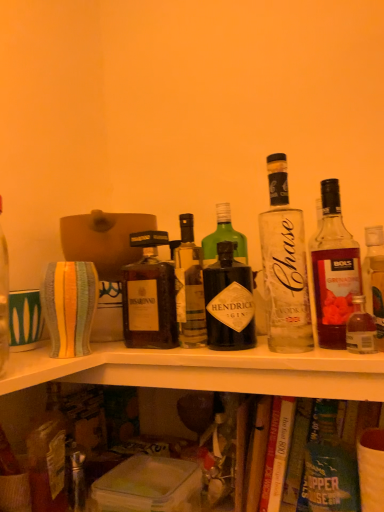
Question: Is dark brown glass bottle at center, which is the 2th bottle in left-to-right order, to the left or to the right of green glass bottle at center, acting as the third bottle starting from the right, in the image?

Choices:
 (A) right
 (B) left

Answer: (B)

Question: Does point (188, 314) appear closer or farther from the camera than point (311, 468)?

Choices:
 (A) farther
 (B) closer

Answer: (A)

Question: Estimate the real-world distances between objects in this image. Which object is farther from the green glass bottle at center, the fourth bottle when ordered from left to right?

Choices:
 (A) clear glass bottle at center, the third bottle in the left-to-right sequence
 (B) matte brown liquor bottle at center, arranged as the sixth bottle when viewed from the right
 (C) translucent glass bottle at upper right, marked as the first bottle in a right-to-left arrangement
 (D) dark brown glass bottle at center, which is the 2th bottle in left-to-right order
 (E) hardcover book at lower center

Answer: (B)

Question: Which object is the closest to the translucent glass bottle at upper right, positioned as the fifth bottle in left-to-right order?

Choices:
 (A) dark brown glass bottle at center, the fifth bottle in the right-to-left sequence
 (B) hardcover book at lower center
 (C) matte brown liquor bottle at center, arranged as the sixth bottle when viewed from the right
 (D) green glass bottle at center, the fourth bottle when ordered from left to right
 (E) translucent glass bottle at upper right, the sixth bottle from the left

Answer: (E)